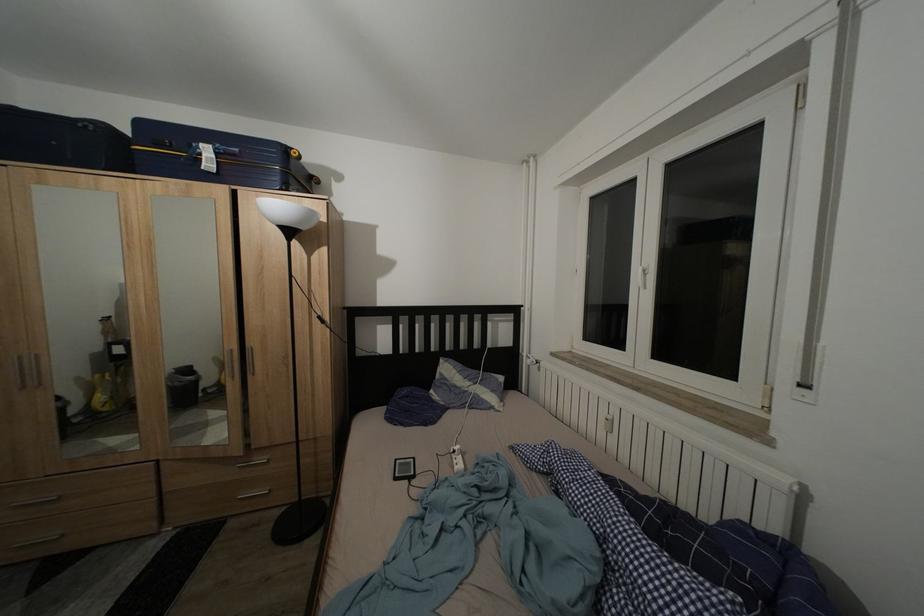
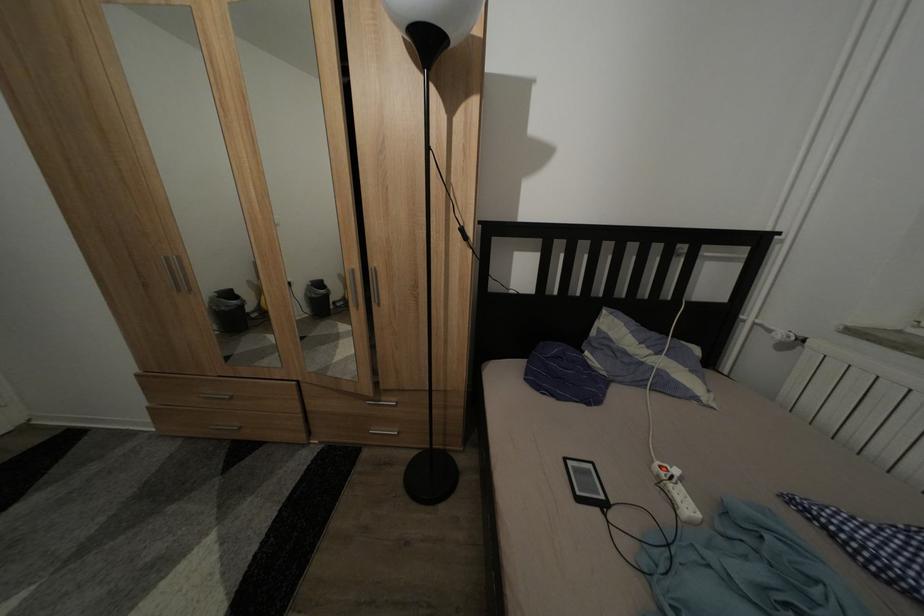
Locate, in the second image, the point that corresponds to (x=404, y=467) in the first image.

(573, 466)